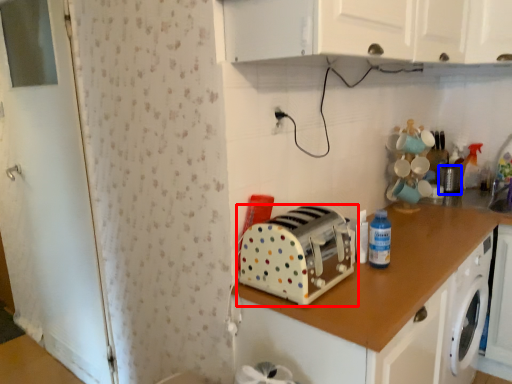
Question: Which of the following is the farthest to the observer, toaster (highlighted by a red box) or appliance (highlighted by a blue box)?

Choices:
 (A) toaster
 (B) appliance

Answer: (B)